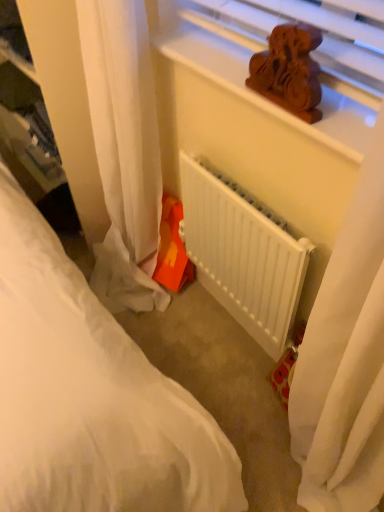
Find the location of a particular element. The width and height of the screenshot is (384, 512). orange plastic toy at lower center is located at coordinates (172, 249).

What are the coordinates of `wooden carving at upper center` in the screenshot? It's located at (247, 75).

How different are the orientations of white sheer curtain at lower left and orange plastic toy at lower center in degrees?

19.1 degrees.

Is white sheer curtain at lower left shorter than orange plastic toy at lower center?

In fact, white sheer curtain at lower left may be taller than orange plastic toy at lower center.

Consider the image. Considering the sizes of objects white sheer curtain at lower left and orange plastic toy at lower center in the image provided, who is thinner, white sheer curtain at lower left or orange plastic toy at lower center?

orange plastic toy at lower center is thinner.

Is white sheer curtain at lower left outside of orange plastic toy at lower center?

Indeed, white sheer curtain at lower left is completely outside orange plastic toy at lower center.

Is white sheer curtain at lower left not close to white matte radiator at center?

No, white sheer curtain at lower left is not far away from white matte radiator at center.

Which is nearer, (135, 40) or (210, 265)?

Point (135, 40)

From the picture: Considering their positions, is white sheer curtain at lower left located in front of or behind white matte radiator at center?

Visually, white sheer curtain at lower left is located in front of white matte radiator at center.

The width and height of the screenshot is (384, 512). I want to click on window sill above the white matte radiator at center (from a real-world perspective), so click(x=247, y=75).

Is white matte radiator at center turned away from wooden carving at upper center?

That's not correct — white matte radiator at center is not looking away from wooden carving at upper center.

Which of these two, white matte radiator at center or wooden carving at upper center, is smaller?

wooden carving at upper center.

From a real-world perspective, is white matte radiator at center positioned above or below wooden carving at upper center?

From a real-world perspective, white matte radiator at center is physically below wooden carving at upper center.

Can you confirm if brown wooden statue at upper center is taller than white fabric bed at lower left?

Yes.

Looking at the image, does brown wooden statue at upper center seem bigger or smaller compared to white fabric bed at lower left?

brown wooden statue at upper center is smaller than white fabric bed at lower left.

Between brown wooden statue at upper center and white fabric bed at lower left, which one appears on the right side from the viewer's perspective?

brown wooden statue at upper center is more to the right.

Which object is more forward, white matte radiator at center or orange plastic toy at lower center?

white matte radiator at center.

This screenshot has width=384, height=512. I want to click on stuff directly beneath the white matte radiator at center (from a real-world perspective), so click(172, 249).

Which point is more forward, (x=286, y=315) or (x=157, y=268)?

The point (x=286, y=315) is closer.

What's the angular difference between white matte radiator at center and orange plastic toy at lower center's facing directions?

There is a 19.6-degree angle between the facing directions of white matte radiator at center and orange plastic toy at lower center.

In the scene shown: Is white fabric bed at lower left facing towards brown wooden statue at upper center?

No, white fabric bed at lower left is not oriented towards brown wooden statue at upper center.

Is brown wooden statue at upper center a part of white fabric bed at lower left?

Actually, brown wooden statue at upper center is outside white fabric bed at lower left.

Is the depth of white fabric bed at lower left greater than that of brown wooden statue at upper center?

Yes, white fabric bed at lower left is further from the camera.

Is white fabric bed at lower left at the left side of brown wooden statue at upper center?

Yes, white fabric bed at lower left is to the left of brown wooden statue at upper center.

Does orange plastic toy at lower center have a greater height compared to wooden carving at upper center?

Correct, orange plastic toy at lower center is much taller as wooden carving at upper center.

Considering the sizes of objects orange plastic toy at lower center and wooden carving at upper center in the image provided, who is bigger, orange plastic toy at lower center or wooden carving at upper center?

orange plastic toy at lower center.

Does point (166, 252) lie in front of point (196, 25)?

No, (166, 252) is behind (196, 25).

Which is correct: orange plastic toy at lower center is inside wooden carving at upper center, or outside of it?

orange plastic toy at lower center cannot be found inside wooden carving at upper center.

You are a GUI agent. You are given a task and a screenshot of the screen. Output one action in this format:
    pyautogui.click(x=<x>, y=<y>)
    Task: Click on the stuff on the right of white sheer curtain at lower left
    The height and width of the screenshot is (512, 384).
    Given the screenshot: What is the action you would take?
    point(172,249)

This screenshot has height=512, width=384. Find the location of `curtain that appears above the white matte radiator at center (from the image's perspective)`. curtain that appears above the white matte radiator at center (from the image's perspective) is located at coordinates (107, 136).

Based on their spatial positions, is white sheer curtain at lower left or white fabric bed at lower left further from white matte radiator at center?

white fabric bed at lower left is positioned further to the anchor white matte radiator at center.

Which object lies further to the anchor point white fabric bed at lower left, white matte radiator at center or brown wooden statue at upper center?

Among the two, brown wooden statue at upper center is located further to white fabric bed at lower left.

From the image, which object appears to be farther from wooden carving at upper center, orange plastic toy at lower center or brown wooden statue at upper center?

orange plastic toy at lower center is further to wooden carving at upper center.

Which object lies nearer to the anchor point brown wooden statue at upper center, white sheer curtain at lower left or wooden carving at upper center?

wooden carving at upper center lies closer to brown wooden statue at upper center than the other object.

Estimate the real-world distances between objects in this image. Which object is further from brown wooden statue at upper center, wooden carving at upper center or white sheer curtain at lower left?

white sheer curtain at lower left is further to brown wooden statue at upper center.

Which object lies further to the anchor point orange plastic toy at lower center, white matte radiator at center or white sheer curtain at lower left?

Based on the image, white matte radiator at center appears to be further to orange plastic toy at lower center.

Considering their positions, is white fabric bed at lower left positioned closer to orange plastic toy at lower center than wooden carving at upper center?

white fabric bed at lower left is closer to orange plastic toy at lower center.

Looking at this image, based on their spatial positions, is orange plastic toy at lower center or white fabric bed at lower left further from white matte radiator at center?

Among the two, white fabric bed at lower left is located further to white matte radiator at center.

I want to click on window sill located between white sheer curtain at lower left and brown wooden statue at upper center in the left-right direction, so click(x=247, y=75).

Find the location of a particular element. The image size is (384, 512). curtain between white fabric bed at lower left and white matte radiator at center from left to right is located at coordinates (107, 136).

Locate an element on the screen. curtain between wooden carving at upper center and white fabric bed at lower left in the up-down direction is located at coordinates (107, 136).

You are a GUI agent. You are given a task and a screenshot of the screen. Output one action in this format:
    pyautogui.click(x=<x>, y=<y>)
    Task: Click on the curtain between brown wooden statue at upper center and orange plastic toy at lower center from front to back
    
    Given the screenshot: What is the action you would take?
    pyautogui.click(x=107, y=136)